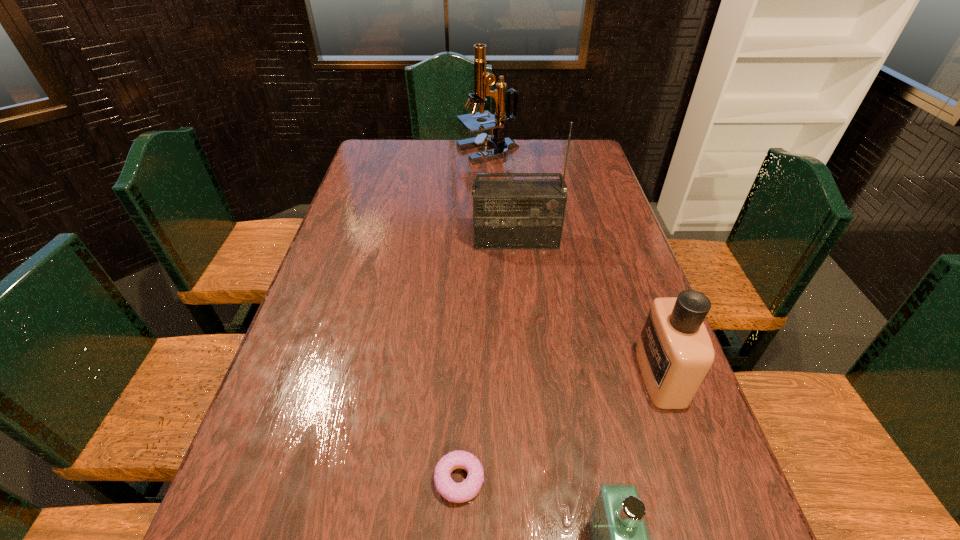
Find the location of `vacant space located on the front label of the rightmost object`. vacant space located on the front label of the rightmost object is located at coordinates (579, 375).

The image size is (960, 540). I want to click on free space located on the front label of the rightmost object, so tap(592, 375).

Identify the location of free space located 0.270m on the front label of the rightmost object. This screenshot has width=960, height=540. pos(521,375).

The height and width of the screenshot is (540, 960). I want to click on free space located 0.080m on the left of the shortest object, so click(x=392, y=480).

Identify the location of object present at the far edge. Image resolution: width=960 pixels, height=540 pixels. (483, 79).

Locate an element on the screen. The width and height of the screenshot is (960, 540). object located at the right edge is located at coordinates (674, 351).

The height and width of the screenshot is (540, 960). I want to click on free space at the far edge of the desktop, so click(463, 168).

In the image, there is a desktop. Identify the location of vacant space at the left edge. (318, 428).

I want to click on vacant space at the right edge, so click(626, 329).

Locate an element on the screen. The height and width of the screenshot is (540, 960). blank space at the far right corner of the desktop is located at coordinates (569, 154).